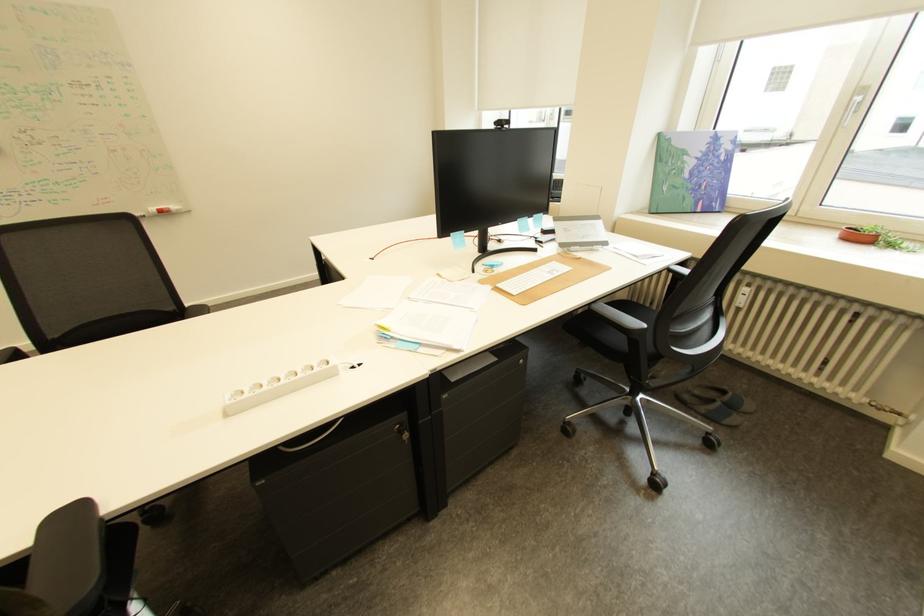
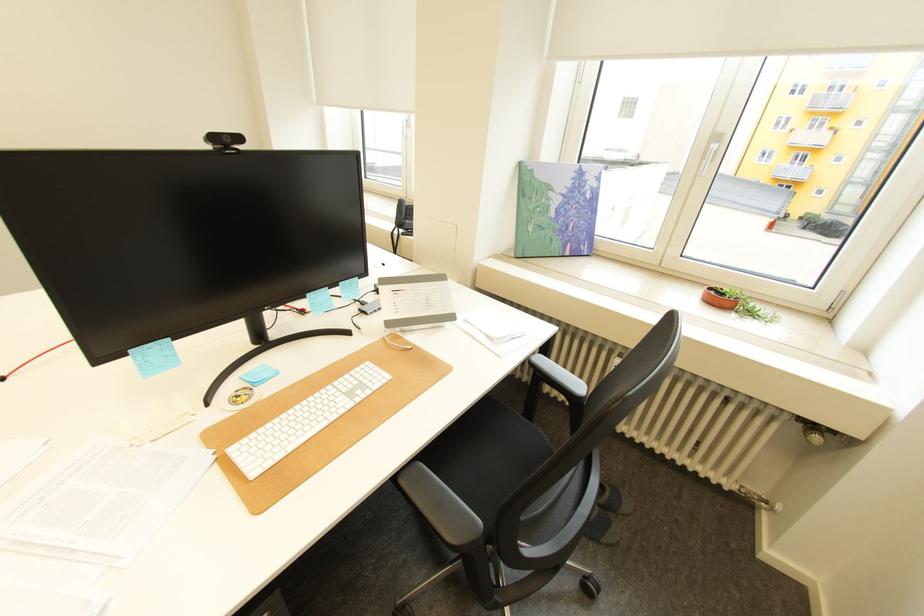
The images are taken continuously from a first-person perspective. In which direction are you moving?

The cameraman walked toward right, forward.